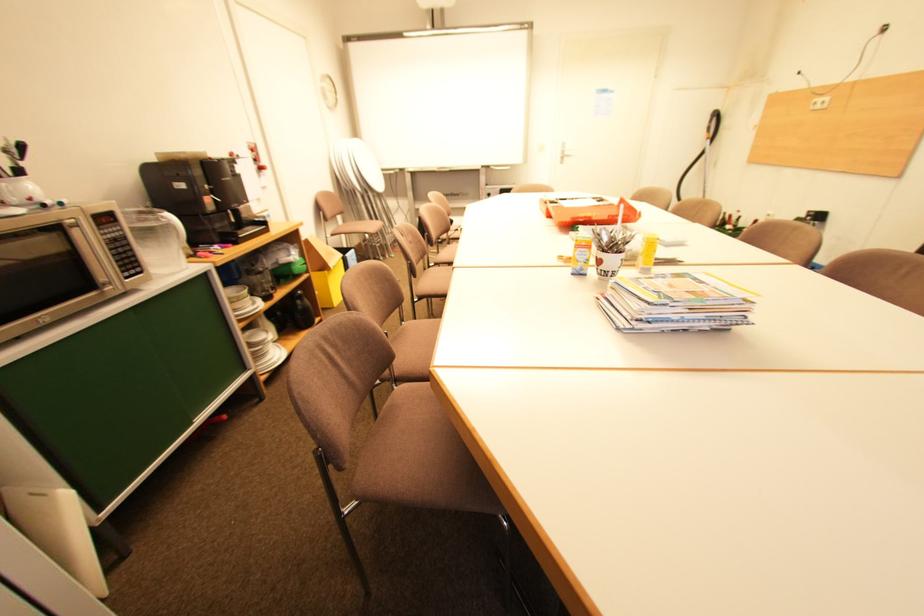
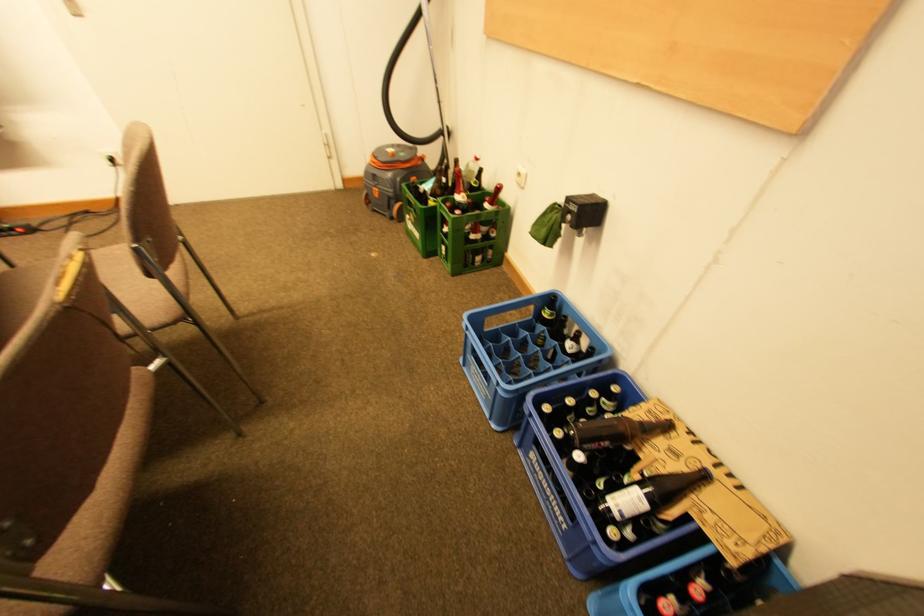
Consider the image. What movement of the cameraman would produce the second image?

The movement direction of the cameraman is right, forward.